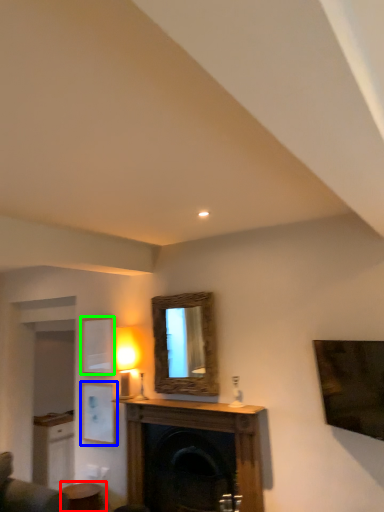
Question: Estimate the real-world distances between objects in this image. Which object is closer to table (highlighted by a red box), picture frame (highlighted by a blue box) or picture frame (highlighted by a green box)?

Choices:
 (A) picture frame
 (B) picture frame

Answer: (A)